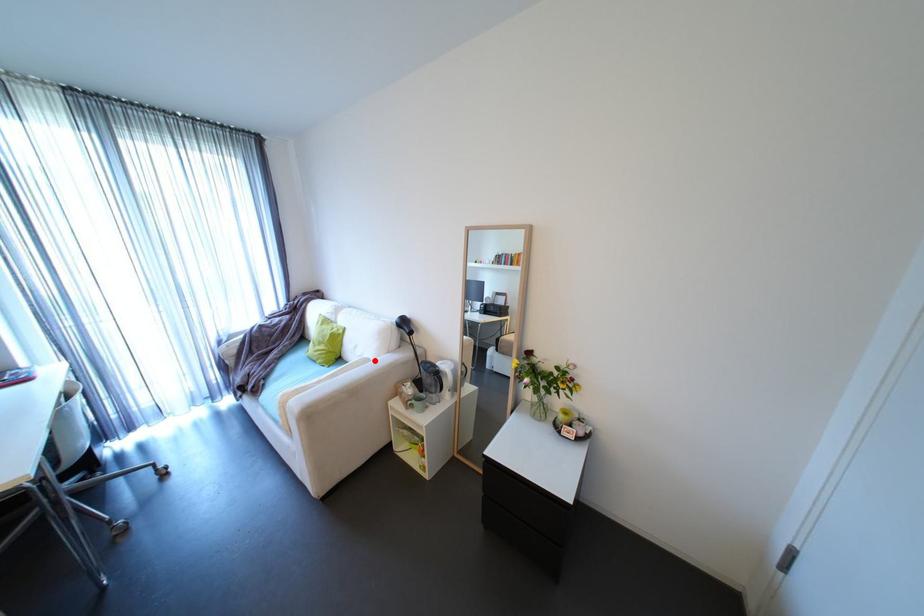
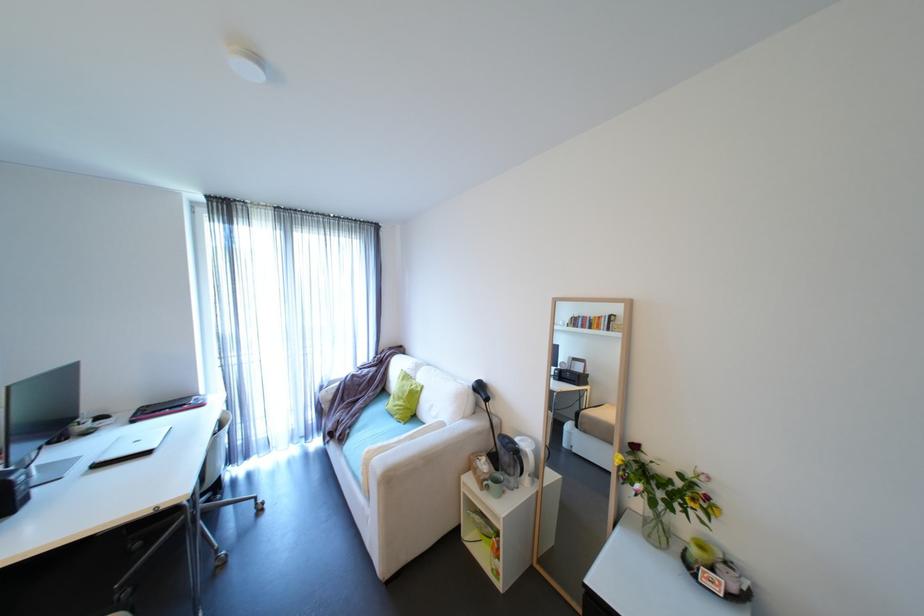
Question: I am providing you with two images of the same scene from different viewpoints. A red point is marked on the first image. At the location where the point appears in image 1, is it still visible in image 2?

Choices:
 (A) Yes
 (B) No

Answer: (A)